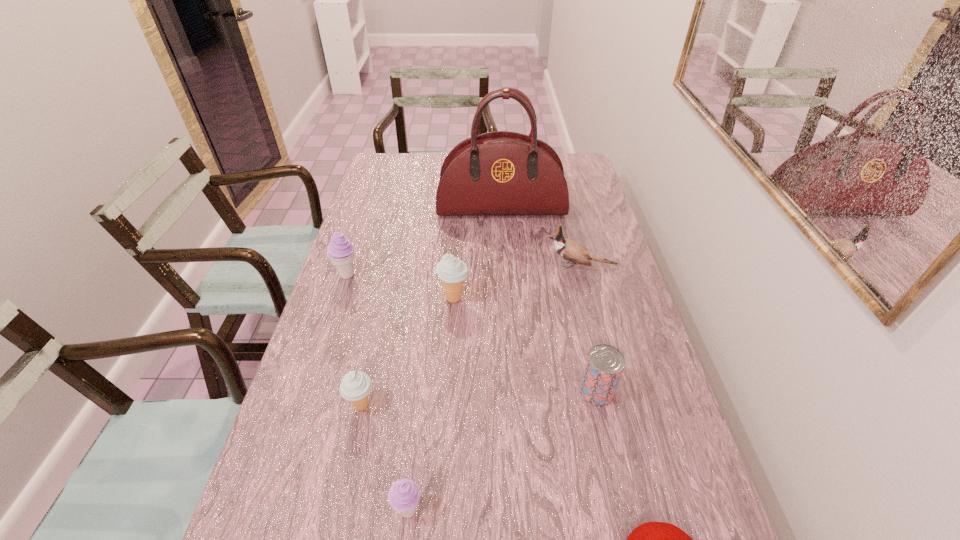
Where is `the second object from left to right`? The image size is (960, 540). the second object from left to right is located at coordinates (355, 386).

Image resolution: width=960 pixels, height=540 pixels. Identify the location of the smaller beige icecream. (355, 386).

Locate an element on the screen. The height and width of the screenshot is (540, 960). vacant region located on the front-facing side of the handbag is located at coordinates (505, 260).

The image size is (960, 540). Find the location of `free space located 0.310m on the right of the fifth nearest object`. free space located 0.310m on the right of the fifth nearest object is located at coordinates (575, 299).

Identify the location of free space located on the back of the farthest icecream. (372, 199).

Identify the location of free spot located at the face of the bird. (430, 267).

Where is `free spot located 0.360m at the face of the bird`? The width and height of the screenshot is (960, 540). free spot located 0.360m at the face of the bird is located at coordinates (430, 267).

Image resolution: width=960 pixels, height=540 pixels. Find the location of `vacant region located at the face of the bird`. vacant region located at the face of the bird is located at coordinates (418, 267).

The width and height of the screenshot is (960, 540). I want to click on free space located on the left of the red beer can, so click(526, 391).

You are a GUI agent. You are given a task and a screenshot of the screen. Output one action in this format:
    pyautogui.click(x=<x>, y=<y>)
    Task: Click on the free space located 0.300m on the back of the right purple icecream
    The image size is (960, 540).
    Given the screenshot: What is the action you would take?
    click(x=424, y=371)